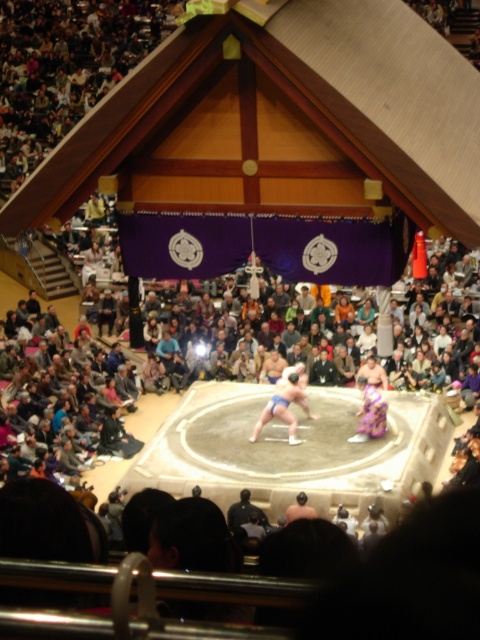
Who is positioned more to the right, blue fabric sumo at center or dark blue fabric kimono at center?

From the viewer's perspective, blue fabric sumo at center appears more on the right side.

Who is more forward, (x=297, y=384) or (x=250, y=513)?

Point (x=250, y=513)

Where is `blue fabric sumo at center`? The width and height of the screenshot is (480, 640). blue fabric sumo at center is located at coordinates (285, 403).